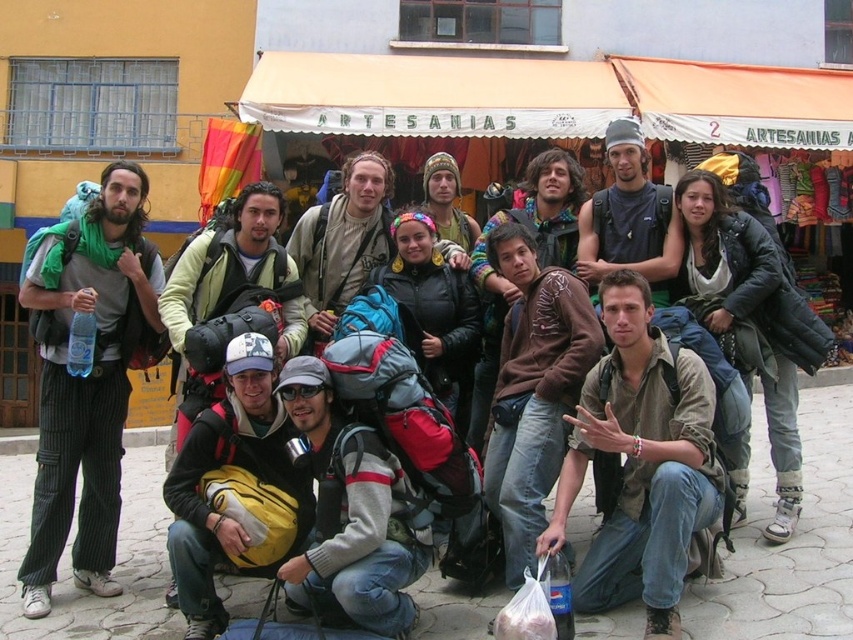
Question: Observing the image, what is the correct spatial positioning of brown textured shirt at center in reference to gray fleece jacket at center?

Choices:
 (A) left
 (B) right

Answer: (B)

Question: Can you confirm if matte black backpack at center is thinner than matte yellow backpack at center?

Choices:
 (A) no
 (B) yes

Answer: (A)

Question: Which point appears farthest from the camera in this image?

Choices:
 (A) (247, 348)
 (B) (372, 172)

Answer: (B)

Question: Which of the following is the closest to the observer?

Choices:
 (A) matte yellow backpack at center
 (B) brown fuzzy sweater at center

Answer: (A)

Question: Is green striped pants at left positioned in front of brown fuzzy sweater at center?

Choices:
 (A) no
 (B) yes

Answer: (B)

Question: Which of the following is the closest to the observer?

Choices:
 (A) brown textured shirt at center
 (B) matte yellow backpack at center

Answer: (A)